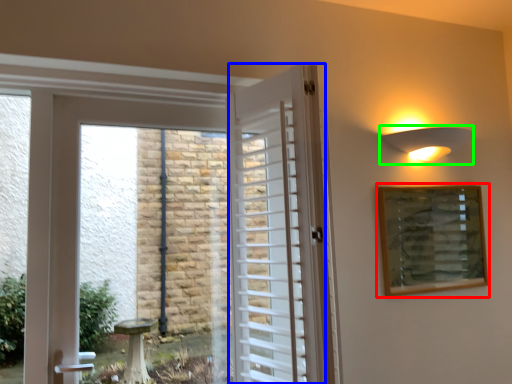
Question: Considering the real-world distances, which object is closest to picture frame (highlighted by a red box)? door (highlighted by a blue box) or light fixture (highlighted by a green box).

Choices:
 (A) door
 (B) light fixture

Answer: (B)